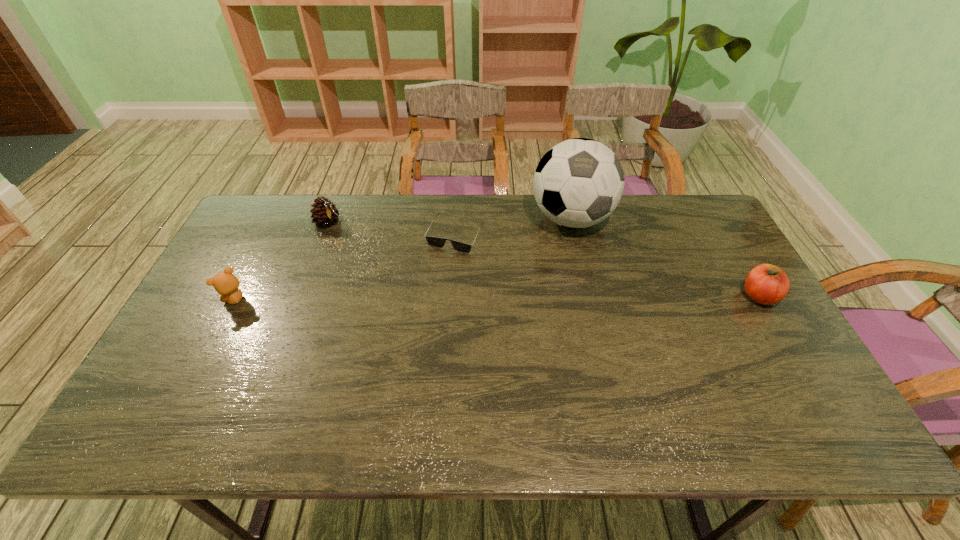
This screenshot has height=540, width=960. I want to click on vacant spot on the desktop that is between the leftmost object and the apple and is positioned on the front-facing side of the sunglasses, so click(424, 298).

Where is `vacant spot on the desktop that is between the teddy bear and the rightmost object and is positioned with a leaf charm attached to the pinecone`? The width and height of the screenshot is (960, 540). vacant spot on the desktop that is between the teddy bear and the rightmost object and is positioned with a leaf charm attached to the pinecone is located at coordinates (430, 298).

At what (x,y) coordinates should I click in order to perform the action: click on free space on the desktop that is between the teddy bear and the rightmost object and is positioned on the main logo of the fourth object from left to right. Please return your answer as a coordinate pair (x, y). Looking at the image, I should click on (565, 298).